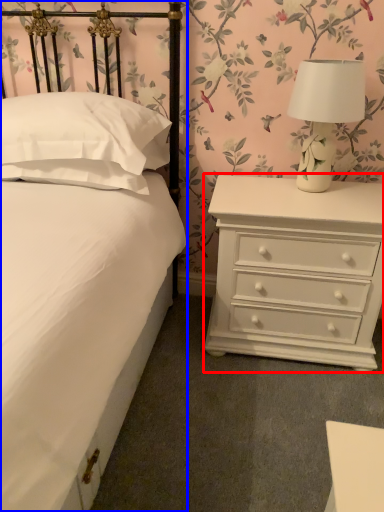
Question: Which of the following is the closest to the observer, chest of drawers (highlighted by a red box) or bed (highlighted by a blue box)?

Choices:
 (A) chest of drawers
 (B) bed

Answer: (B)